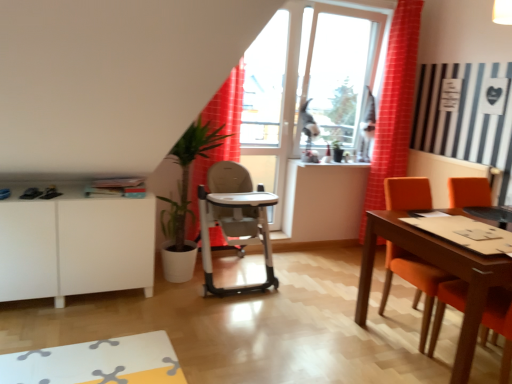
Question: In terms of width, does green leafy plant at center look wider or thinner when compared to silver metallic highchair at center?

Choices:
 (A) thin
 (B) wide

Answer: (A)

Question: Is green leafy plant at center inside the boundaries of silver metallic highchair at center, or outside?

Choices:
 (A) outside
 (B) inside

Answer: (B)

Question: Which object is the closest to the red checkered curtain at right, which is the 1th curtain from right to left?

Choices:
 (A) matte orange chair at right
 (B) transparent glass window at center
 (C) green leafy plant at center
 (D) red fabric curtain at center, which ranks as the 1th curtain in left-to-right order
 (E) white matte cabinet at lower left

Answer: (B)

Question: Estimate the real-world distances between objects in this image. Which object is closer to the matte orange chair at right?

Choices:
 (A) red fabric curtain at center, which ranks as the 1th curtain in left-to-right order
 (B) red checkered curtain at right, positioned as the second curtain in left-to-right order
 (C) green leafy plant at center
 (D) silver metallic highchair at center
 (E) transparent glass window at center

Answer: (D)